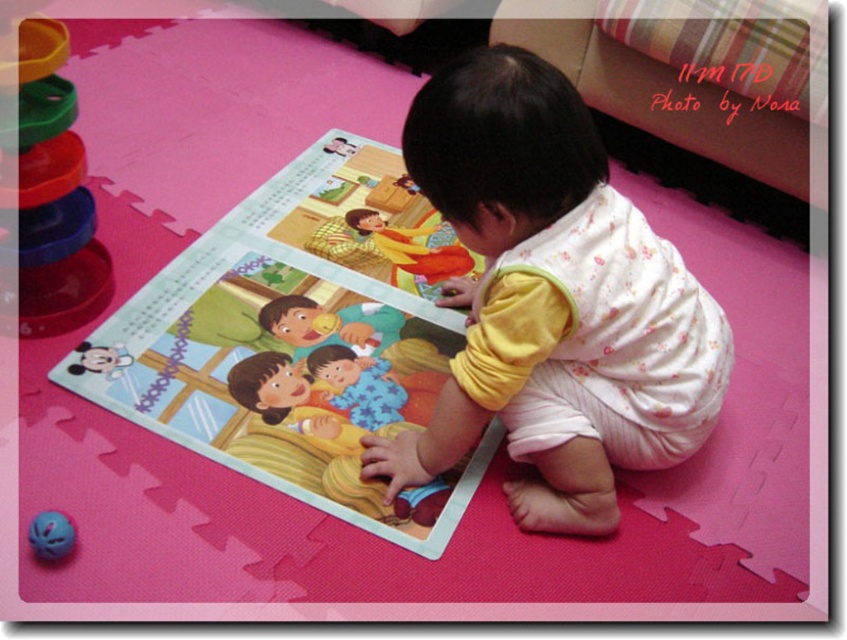
Question: Can you confirm if soft pastel pajamas at center is positioned to the left of purple rubber ball at lower left?

Choices:
 (A) yes
 (B) no

Answer: (B)

Question: Does white floral onesie at center lie in front of stacked plastic rings at left?

Choices:
 (A) yes
 (B) no

Answer: (A)

Question: Which object is positioned closest to the pink foam mat at center?

Choices:
 (A) stacked plastic rings at left
 (B) white floral onesie at center

Answer: (B)

Question: Which point appears farthest from the camera in this image?

Choices:
 (A) (519, 524)
 (B) (53, 115)
 (C) (299, 458)

Answer: (C)

Question: Can you confirm if soft pastel pajamas at center is positioned below purple rubber ball at lower left?

Choices:
 (A) no
 (B) yes

Answer: (A)

Question: Which point is closer to the camera?

Choices:
 (A) white floral onesie at center
 (B) soft pastel pajamas at center
 (C) stacked plastic rings at left

Answer: (A)